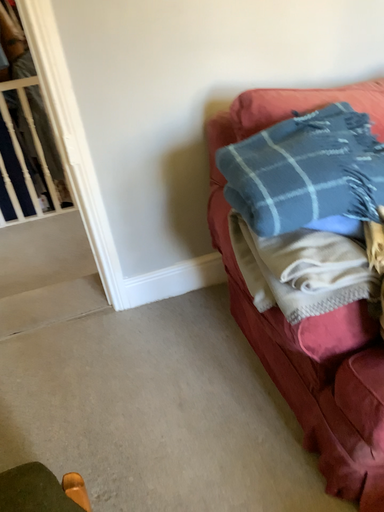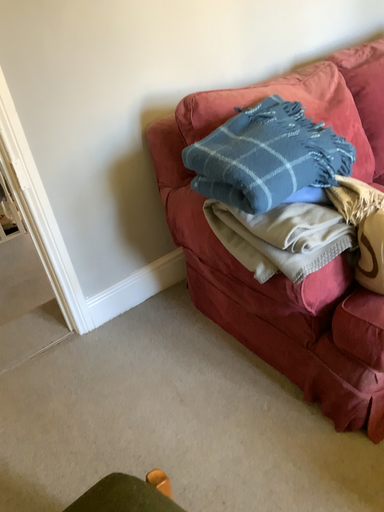
Question: Which way did the camera rotate in the video?

Choices:
 (A) rotated left
 (B) rotated right

Answer: (B)